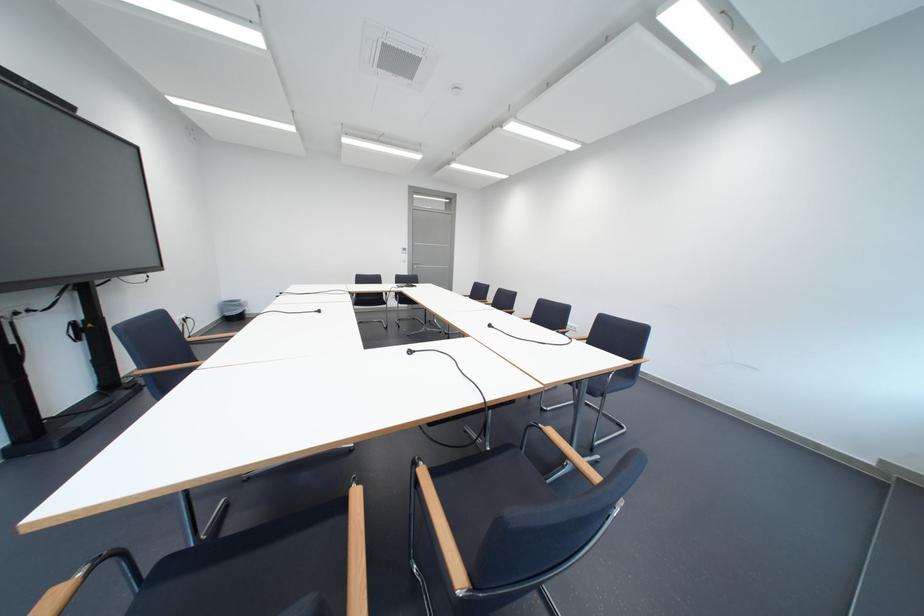
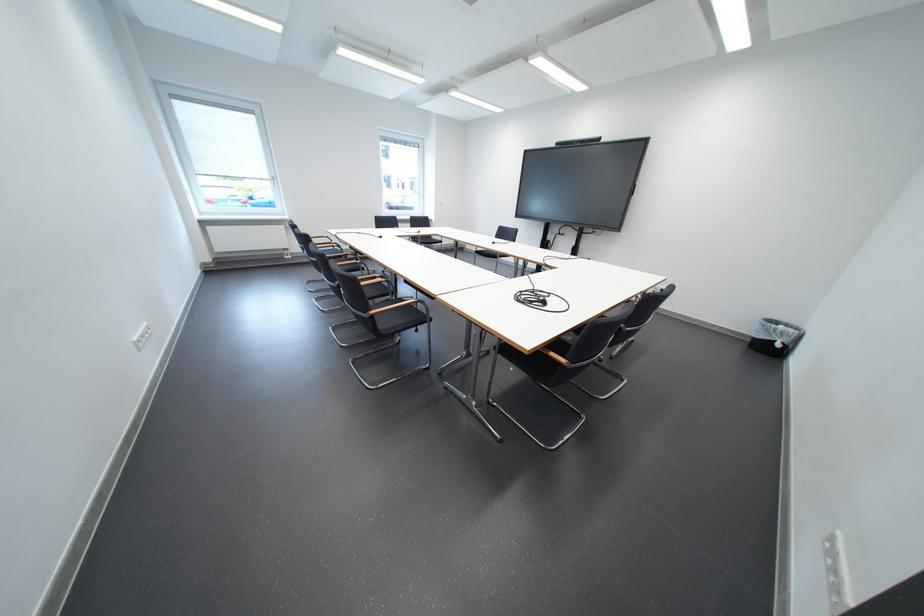
Question: I am providing you with two images of the same scene from different viewpoints. Which of the following objects are not visible in image2?

Choices:
 (A) wall power outlet
 (B) wooden chair armrest
 (C) black chair seat
 (D) black booklet

Answer: (B)